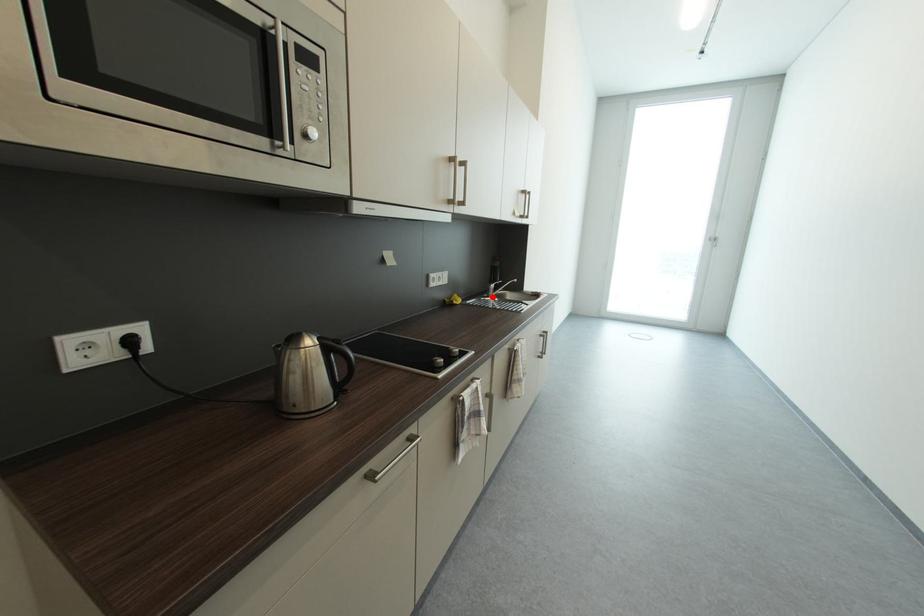
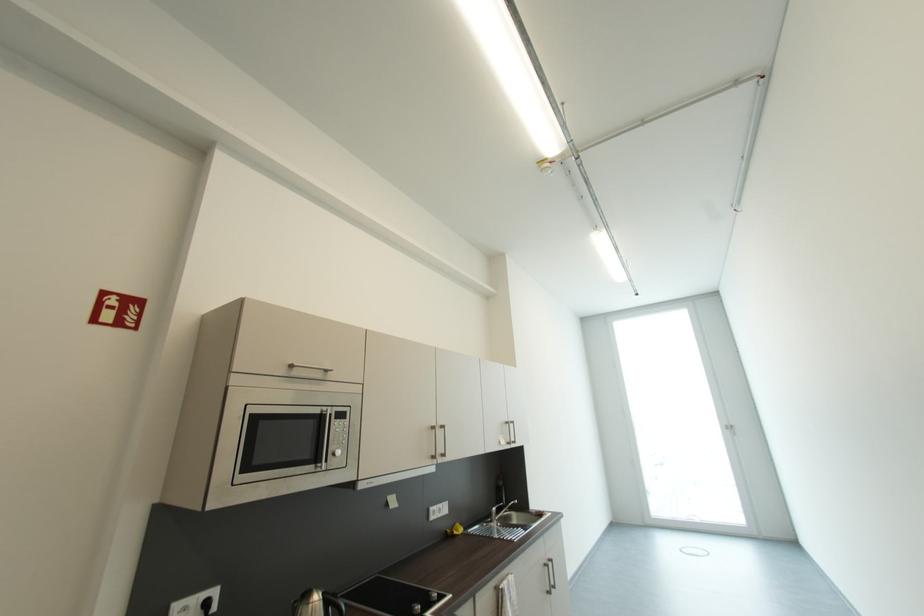
Find the pixel in the second image that matches the highlighted location in the first image.

(495, 522)